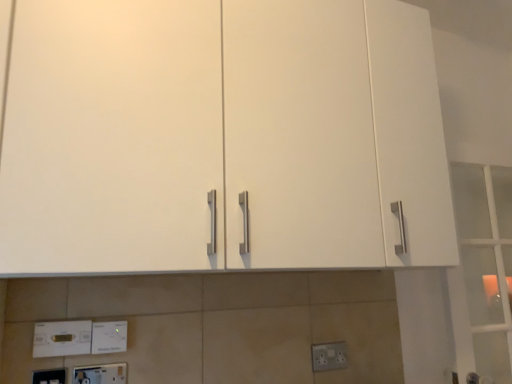
What is the approximate width of silver metallic electric outlet at lower center?

silver metallic electric outlet at lower center is 0.90 inches wide.

This screenshot has width=512, height=384. What do you see at coordinates (329, 356) in the screenshot?
I see `silver metallic electric outlet at lower center` at bounding box center [329, 356].

Locate an element on the screen. silver metallic electric outlet at lower center is located at coordinates (329, 356).

Measure the distance between silver metallic electric outlet at lower center and camera.

They are 4.91 feet apart.

Find the location of a particular element. silver metallic electric outlet at lower center is located at coordinates (329, 356).